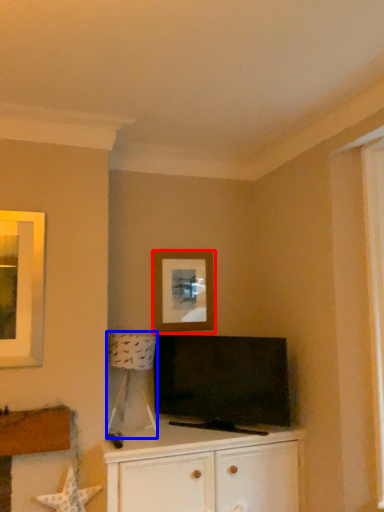
Question: Which point is further to the camera, picture frame (highlighted by a red box) or lamp (highlighted by a blue box)?

Choices:
 (A) picture frame
 (B) lamp

Answer: (A)